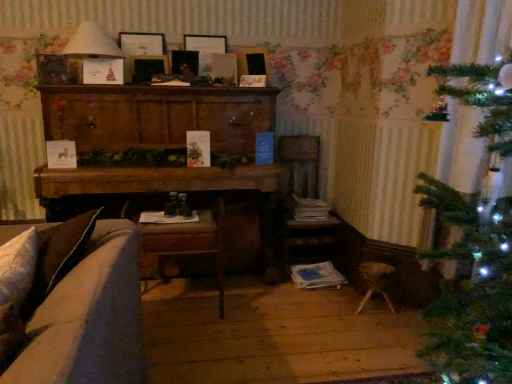
Question: Which direction should I rotate to look at matte wooden picture frame at upper center, the 4th picture frame in the right-to-left sequence, — up or down?

Choices:
 (A) up
 (B) down

Answer: (A)

Question: Is woodenchair at lower center completely or partially outside of wooden picture frame at upper center, marked as the 3th picture frame in a left-to-right arrangement?

Choices:
 (A) yes
 (B) no

Answer: (A)

Question: Considering the relative positions of woodenchair at lower center and wooden picture frame at upper center, the second picture frame in the right-to-left sequence, in the image provided, is woodenchair at lower center behind wooden picture frame at upper center, the second picture frame in the right-to-left sequence,?

Choices:
 (A) no
 (B) yes

Answer: (A)

Question: Considering the relative sizes of woodenchair at lower center and wooden picture frame at upper center, marked as the 3th picture frame in a left-to-right arrangement, in the image provided, is woodenchair at lower center smaller than wooden picture frame at upper center, marked as the 3th picture frame in a left-to-right arrangement,?

Choices:
 (A) no
 (B) yes

Answer: (A)

Question: Considering the relative sizes of woodenchair at lower center and wooden picture frame at upper center, the second picture frame in the right-to-left sequence, in the image provided, is woodenchair at lower center bigger than wooden picture frame at upper center, the second picture frame in the right-to-left sequence,?

Choices:
 (A) no
 (B) yes

Answer: (B)

Question: Is woodenchair at lower center facing away from wooden picture frame at upper center, marked as the 3th picture frame in a left-to-right arrangement?

Choices:
 (A) no
 (B) yes

Answer: (A)

Question: Is woodenchair at lower center far from wooden picture frame at upper center, marked as the 3th picture frame in a left-to-right arrangement?

Choices:
 (A) no
 (B) yes

Answer: (B)

Question: Does wooden armchair at center have a greater width compared to wooden picture frame at center, marked as the second picture frame in a left-to-right arrangement?

Choices:
 (A) no
 (B) yes

Answer: (B)

Question: Does wooden armchair at center have a greater height compared to wooden picture frame at center, marked as the second picture frame in a left-to-right arrangement?

Choices:
 (A) yes
 (B) no

Answer: (A)

Question: Is wooden armchair at center directly adjacent to wooden picture frame at center, the 3th picture frame positioned from the right?

Choices:
 (A) yes
 (B) no

Answer: (B)

Question: Is wooden armchair at center outside of wooden picture frame at center, marked as the second picture frame in a left-to-right arrangement?

Choices:
 (A) yes
 (B) no

Answer: (A)

Question: From a real-world perspective, is wooden armchair at center positioned under wooden picture frame at center, marked as the second picture frame in a left-to-right arrangement, based on gravity?

Choices:
 (A) yes
 (B) no

Answer: (A)

Question: Does wooden armchair at center come behind wooden picture frame at center, marked as the second picture frame in a left-to-right arrangement?

Choices:
 (A) yes
 (B) no

Answer: (A)

Question: Considering the relative sizes of wooden picture frame at center, the 3th picture frame positioned from the right, and matte white lampshade at upper left in the image provided, is wooden picture frame at center, the 3th picture frame positioned from the right, bigger than matte white lampshade at upper left?

Choices:
 (A) yes
 (B) no

Answer: (B)